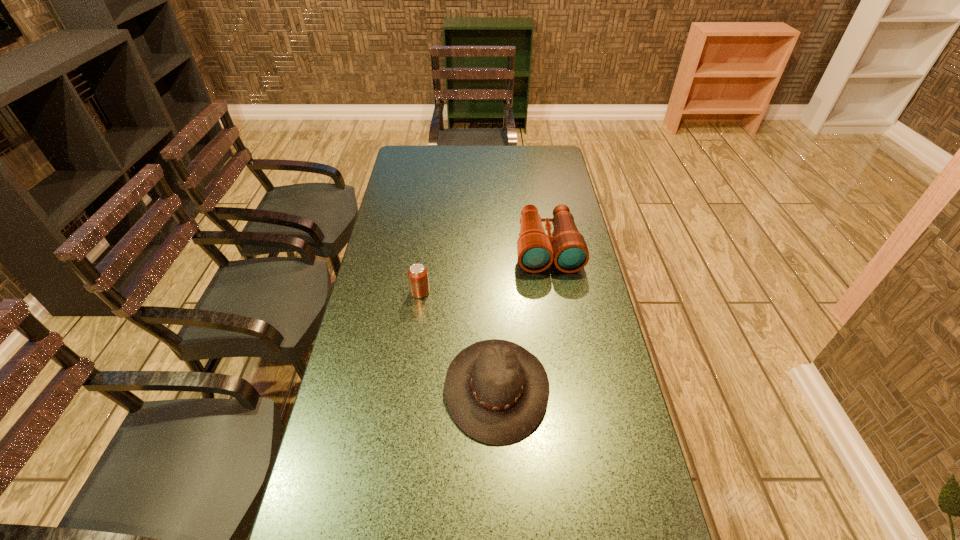
Locate an element on the screen. blank area in the image that satisfies the following two spatial constraints: 1. through the lenses of the binoculars; 2. on the front-facing side of the nearest object is located at coordinates (571, 388).

The image size is (960, 540). In order to click on free location that satisfies the following two spatial constraints: 1. through the lenses of the binoculars; 2. on the front-facing side of the nearest object in this screenshot , I will do `click(571, 388)`.